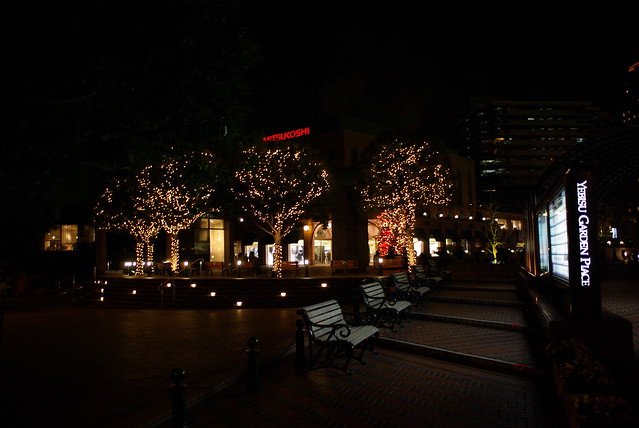
I want to click on benches, so click(330, 320), click(376, 298), click(409, 284), click(427, 279).